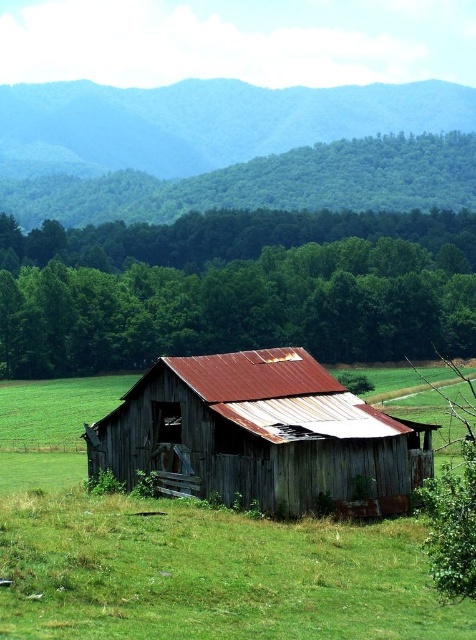
Question: Does rusty metal barn at center have a smaller size compared to green forested hillside at upper left?

Choices:
 (A) yes
 (B) no

Answer: (A)

Question: Which object is closer to the camera taking this photo?

Choices:
 (A) green forested hillside at upper left
 (B) rusty metal barn at center

Answer: (B)

Question: Is rusty metal barn at center thinner than green forested hillside at upper left?

Choices:
 (A) no
 (B) yes

Answer: (B)

Question: Is rusty metal barn at center to the left of green forested hillside at upper left from the viewer's perspective?

Choices:
 (A) no
 (B) yes

Answer: (A)